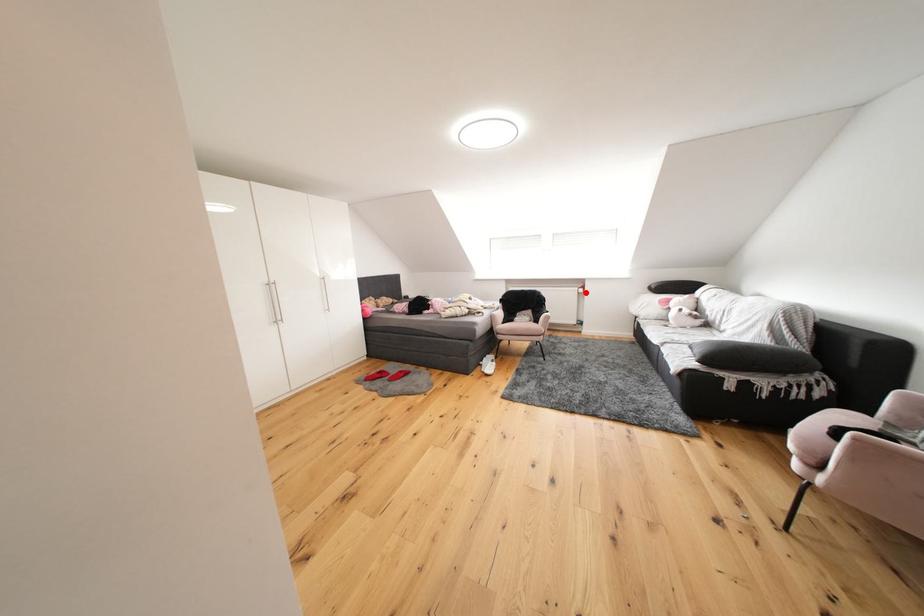
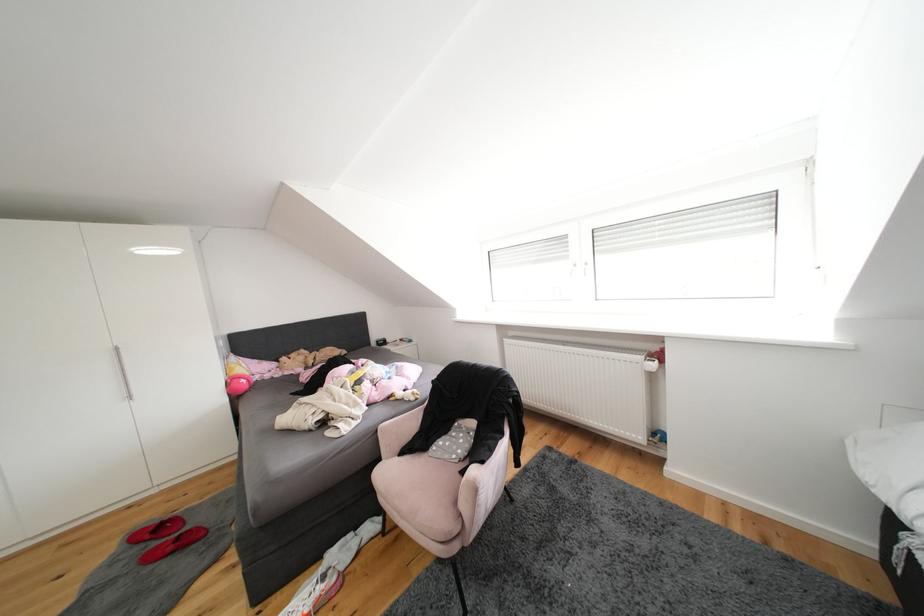
Question: I am providing you with two images of the same scene from different viewpoints. In image1, a red point is highlighted. Considering the same 3D point in image2, which of the following is correct?

Choices:
 (A) It is closer
 (B) It is farther

Answer: (B)